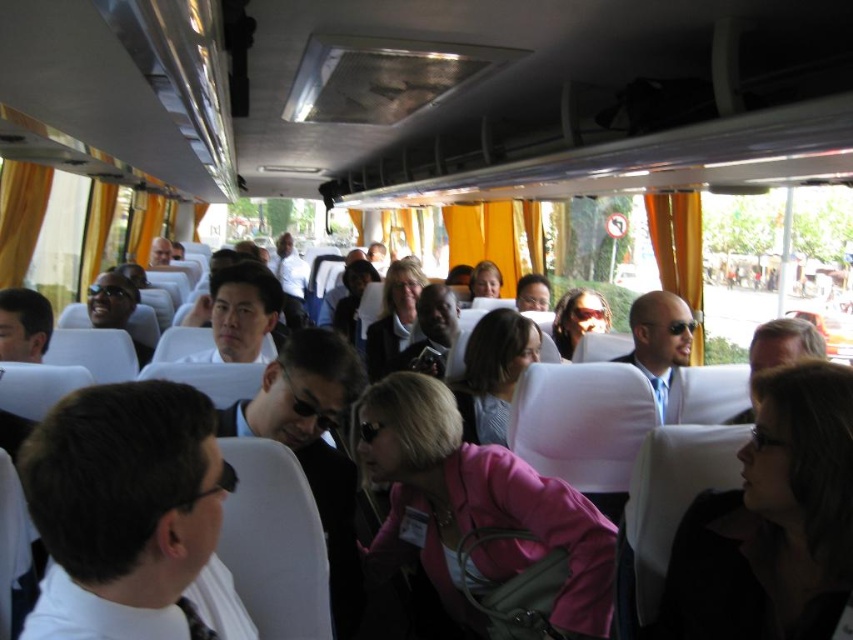
You are a passenger on a bus and you see a pink fabric jacket at center. Where is the pink fabric jacket located in relation to the bus seats?

The pink fabric jacket at center is located at point 0.583 along the horizontal axis and 0.579 along the vertical axis relative to the bus seats.

You are standing in the bus and want to reach a point that is exactly at coordinates point (479,344). If your current position is 10 feet away from that point, can you move forward to reach it?

The distance of point (479,344) from viewer is 9.48 feet, so yes, you can move forward to reach it since you are currently 10 feet away and need to cover 9.48 feet.

You are a passenger on the bus and want to reach the pink matte jacket at center without disturbing the matte black sunglasses at center. Is this possible?

The pink matte jacket at center is positioned under matte black sunglasses at center, so you can reach the pink matte jacket at center without moving the matte black sunglasses at center.